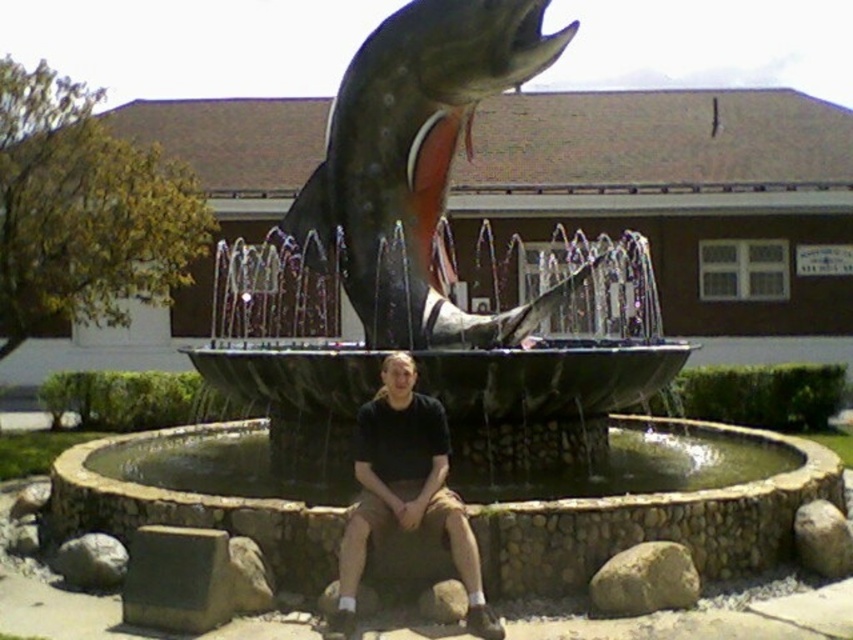
Question: Does shiny metallic fish at center appear over brown rough rock at lower right?

Choices:
 (A) no
 (B) yes

Answer: (B)

Question: Which point is farther from the camera taking this photo?

Choices:
 (A) pyautogui.click(x=416, y=497)
 (B) pyautogui.click(x=824, y=513)
 (C) pyautogui.click(x=59, y=573)
 (D) pyautogui.click(x=418, y=600)

Answer: (C)

Question: Does shiny metallic fish at center appear over black cotton shirt at center?

Choices:
 (A) no
 (B) yes

Answer: (B)

Question: Which point appears closest to the camera in this image?

Choices:
 (A) (109, 561)
 (B) (438, 621)
 (C) (798, 509)

Answer: (B)

Question: Among these points, which one is farthest from the camera?

Choices:
 (A) (822, 563)
 (B) (346, 205)
 (C) (637, 573)
 (D) (74, 540)

Answer: (B)

Question: Considering the relative positions of brown rough rock at lower right and gray rock at lower center in the image provided, where is brown rough rock at lower right located with respect to gray rock at lower center?

Choices:
 (A) right
 (B) left

Answer: (A)